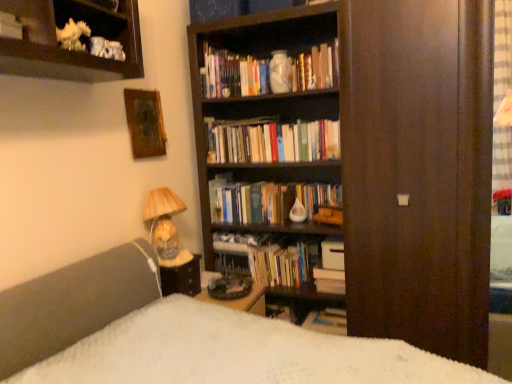
Question: Is wooden desk at center positioned behind matte brown table at lower left?

Choices:
 (A) yes
 (B) no

Answer: (A)

Question: Considering the relative sizes of wooden desk at center and matte brown table at lower left in the image provided, is wooden desk at center wider than matte brown table at lower left?

Choices:
 (A) yes
 (B) no

Answer: (A)

Question: Does wooden desk at center appear on the right side of matte brown table at lower left?

Choices:
 (A) yes
 (B) no

Answer: (A)

Question: Is wooden desk at center closer to camera compared to matte brown table at lower left?

Choices:
 (A) yes
 (B) no

Answer: (B)

Question: From a real-world perspective, is wooden desk at center physically above matte brown table at lower left?

Choices:
 (A) yes
 (B) no

Answer: (B)

Question: Is point (179, 201) closer or farther from the camera than point (328, 314)?

Choices:
 (A) closer
 (B) farther

Answer: (A)

Question: Is matte ceramic lamp at lower left taller or shorter than hardcover book at center, which ranks as the 1th book in bottom-to-top order?

Choices:
 (A) tall
 (B) short

Answer: (A)

Question: From the image's perspective, is matte ceramic lamp at lower left located above or below hardcover book at center, which ranks as the 1th book in bottom-to-top order?

Choices:
 (A) above
 (B) below

Answer: (A)

Question: Looking at their shapes, would you say matte ceramic lamp at lower left is wider or thinner than hardcover book at center, positioned as the 6th book in top-to-bottom order?

Choices:
 (A) thin
 (B) wide

Answer: (A)

Question: Considering the relative positions of porcelain vase at upper center and white matte book at lower center, marked as the 3th book in a top-to-bottom arrangement, in the image provided, is porcelain vase at upper center to the left or to the right of white matte book at lower center, marked as the 3th book in a top-to-bottom arrangement,?

Choices:
 (A) right
 (B) left

Answer: (B)

Question: Is porcelain vase at upper center wider or thinner than white matte book at lower center, marked as the fourth book in a bottom-to-top arrangement?

Choices:
 (A) thin
 (B) wide

Answer: (A)

Question: Is porcelain vase at upper center spatially inside white matte book at lower center, marked as the fourth book in a bottom-to-top arrangement, or outside of it?

Choices:
 (A) outside
 (B) inside

Answer: (A)

Question: From their relative heights in the image, would you say porcelain vase at upper center is taller or shorter than white matte book at lower center, marked as the fourth book in a bottom-to-top arrangement?

Choices:
 (A) short
 (B) tall

Answer: (B)

Question: Based on their positions, is hardcover book at center, positioned as the 6th book in top-to-bottom order, located to the left or right of hardcover books at upper center, which is the 6th book in bottom-to-top order?

Choices:
 (A) right
 (B) left

Answer: (A)

Question: From a real-world perspective, is hardcover book at center, which ranks as the 1th book in bottom-to-top order, positioned above or below hardcover books at upper center, which ranks as the 1th book in top-to-bottom order?

Choices:
 (A) below
 (B) above

Answer: (A)